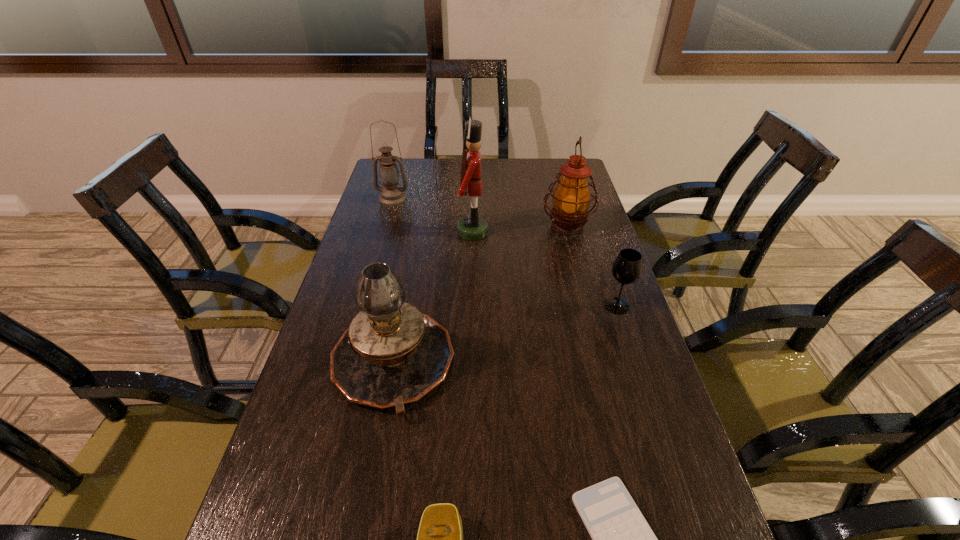
This screenshot has width=960, height=540. Find the location of `the tallest object`. the tallest object is located at coordinates (472, 227).

Find the location of a particular element. the rightmost oil lamp is located at coordinates (571, 198).

The width and height of the screenshot is (960, 540). In order to click on the farthest oil lamp in this screenshot , I will do `click(392, 195)`.

The height and width of the screenshot is (540, 960). I want to click on the nearest oil lamp, so click(x=391, y=354).

The width and height of the screenshot is (960, 540). I want to click on wineglass, so click(x=627, y=268).

The image size is (960, 540). In order to click on the fifth tallest object in this screenshot , I will do `click(627, 268)`.

This screenshot has width=960, height=540. Find the location of `free spot located 0.230m on the front-facing side of the nutcracker`. free spot located 0.230m on the front-facing side of the nutcracker is located at coordinates (559, 232).

The width and height of the screenshot is (960, 540). Identify the location of vacant space located on the back of the rightmost oil lamp. (555, 177).

Where is `free location located on the front of the farthest oil lamp`? This screenshot has width=960, height=540. free location located on the front of the farthest oil lamp is located at coordinates (378, 248).

Locate an element on the screen. The width and height of the screenshot is (960, 540). blank space located 0.210m on the front of the nearest oil lamp is located at coordinates (361, 535).